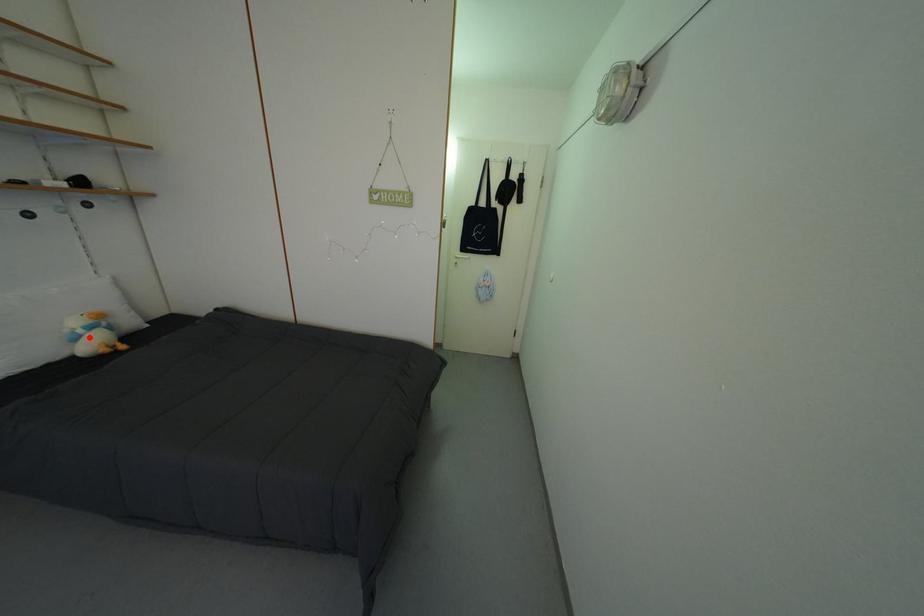
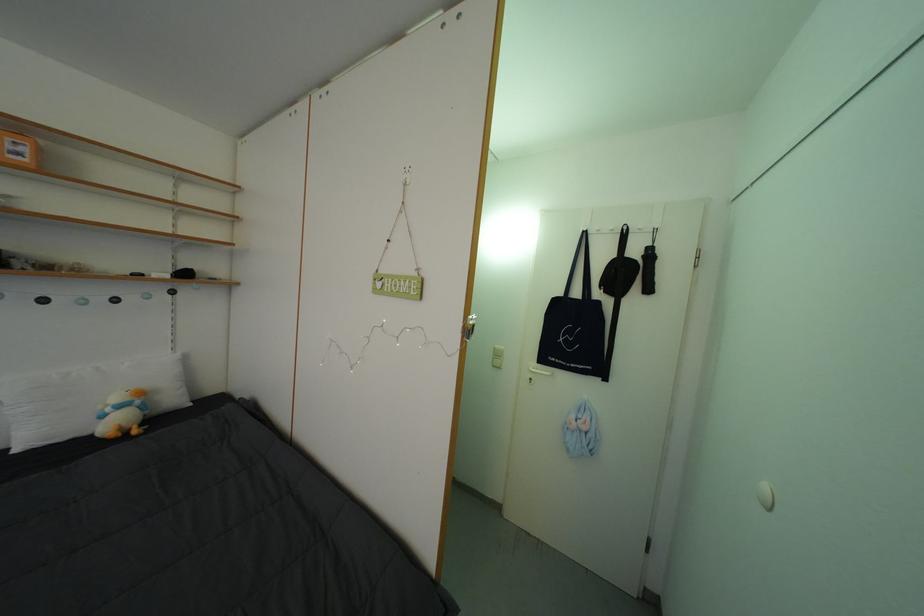
Question: I am providing you with two images of the same scene from different viewpoints. A red point is shown in image1. For the corresponding object point in image2, is it positioned nearer or farther from the camera?

Choices:
 (A) Nearer
 (B) Farther

Answer: (A)